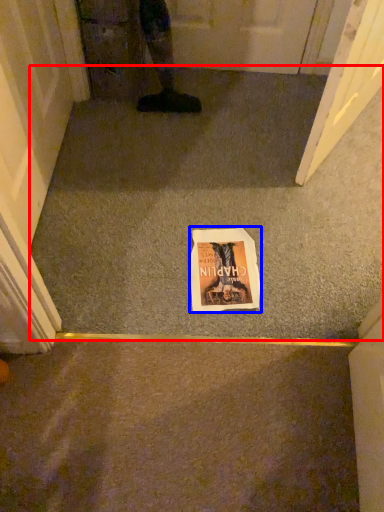
Question: Which object appears closest to the camera in this image, concrete (highlighted by a red box) or comic book (highlighted by a blue box)?

Choices:
 (A) concrete
 (B) comic book

Answer: (A)